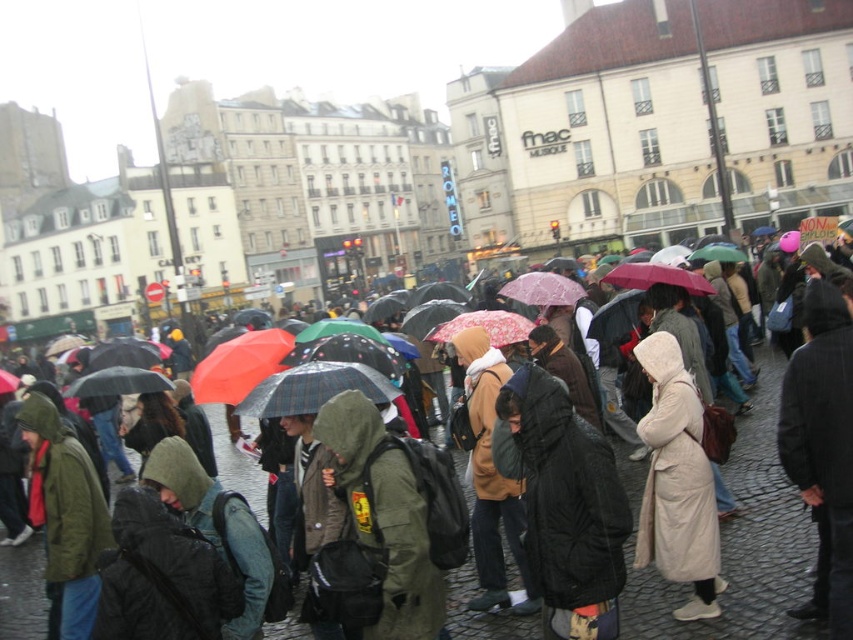
Question: Among these objects, which one is farthest from the camera?

Choices:
 (A) light beige coat at center
 (B) cobblestone pavement at center

Answer: (A)

Question: Can you confirm if cobblestone pavement at center is wider than light beige coat at center?

Choices:
 (A) no
 (B) yes

Answer: (B)

Question: Which point appears closest to the camera in this image?

Choices:
 (A) (663, 364)
 (B) (781, 620)

Answer: (B)

Question: Does cobblestone pavement at center come behind light beige coat at center?

Choices:
 (A) no
 (B) yes

Answer: (A)

Question: Where is cobblestone pavement at center located in relation to light beige coat at center in the image?

Choices:
 (A) left
 (B) right

Answer: (A)

Question: Which object appears closest to the camera in this image?

Choices:
 (A) cobblestone pavement at center
 (B) light beige coat at center

Answer: (A)